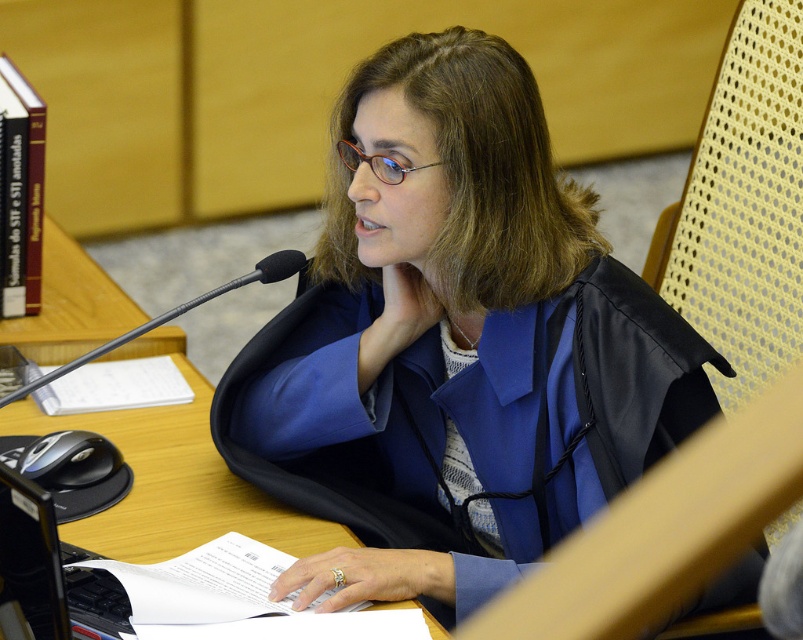
Question: In this image, where is blue fabric at center located relative to black matte microphone at center?

Choices:
 (A) right
 (B) left

Answer: (A)

Question: Based on their relative distances, which object is farther from the brown plastic glasses at center?

Choices:
 (A) black matte microphone at center
 (B) wooden table at center
 (C) blue fabric at center

Answer: (B)

Question: Does black matte microphone at center lie behind brown plastic glasses at center?

Choices:
 (A) yes
 (B) no

Answer: (B)

Question: Among these objects, which one is nearest to the camera?

Choices:
 (A) brown plastic glasses at center
 (B) blue fabric at center

Answer: (B)

Question: Which object is the closest to the wooden table at center?

Choices:
 (A) blue fabric at center
 (B) black matte microphone at center

Answer: (B)

Question: Is black matte microphone at center thinner than brown plastic glasses at center?

Choices:
 (A) yes
 (B) no

Answer: (B)